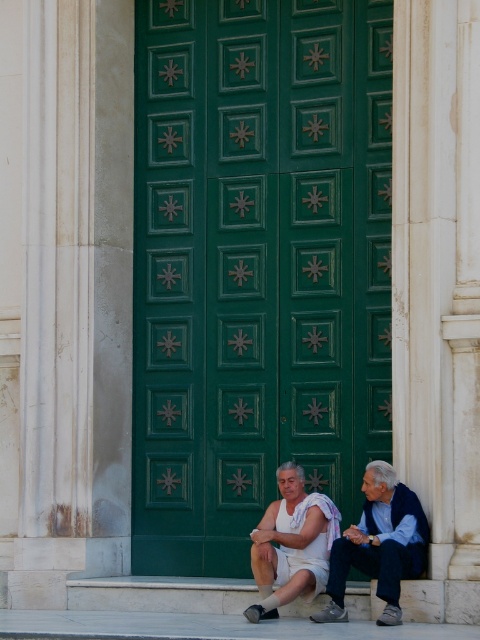
Question: Does green painted wood door at center have a lesser width compared to white cotton shorts at center?

Choices:
 (A) no
 (B) yes

Answer: (A)

Question: Among these points, which one is farthest from the camera?

Choices:
 (A) (319, 288)
 (B) (305, 595)

Answer: (A)

Question: Is green painted wood door at center closer to camera compared to light blue denim jeans at lower right?

Choices:
 (A) yes
 (B) no

Answer: (B)

Question: Is green painted wood door at center to the left of light blue denim jeans at lower right from the viewer's perspective?

Choices:
 (A) no
 (B) yes

Answer: (B)

Question: Which object is positioned closest to the light blue denim jeans at lower right?

Choices:
 (A) white cotton shorts at center
 (B) green painted wood door at center

Answer: (A)

Question: Among these points, which one is farthest from the camera?

Choices:
 (A) (340, 189)
 (B) (274, 566)
 (C) (373, 474)

Answer: (A)